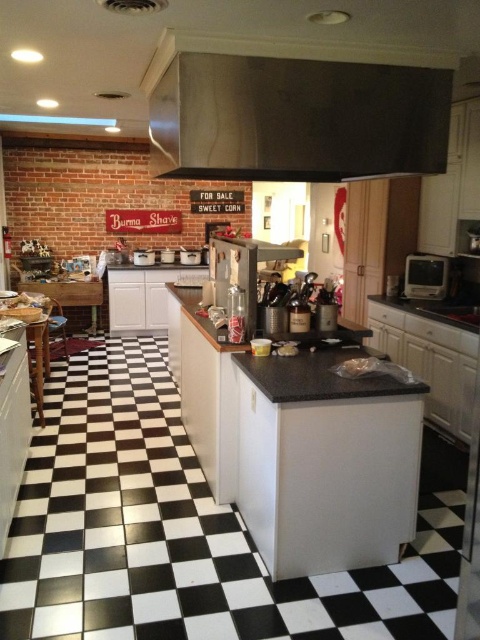
You are organizing the kitchen and need to place a new appliance between the metallic silver toaster at right and the black granite sink at right. Where should you place it to ensure it is between them?

The metallic silver toaster at right is positioned on the left side of the black granite sink at right, so placing the new appliance between them would require placing it to the right of the metallic silver toaster at right and to the left of the black granite sink at right.

Based on the photo, you are a kitchen designer planning to place a new appliance between the metallic silver toaster at right and the black granite sink at right. Which appliance would require less space in width?

The metallic silver toaster at right is thinner than the black granite sink at right, so an appliance placed between them would require less space if aligned with the toaster.